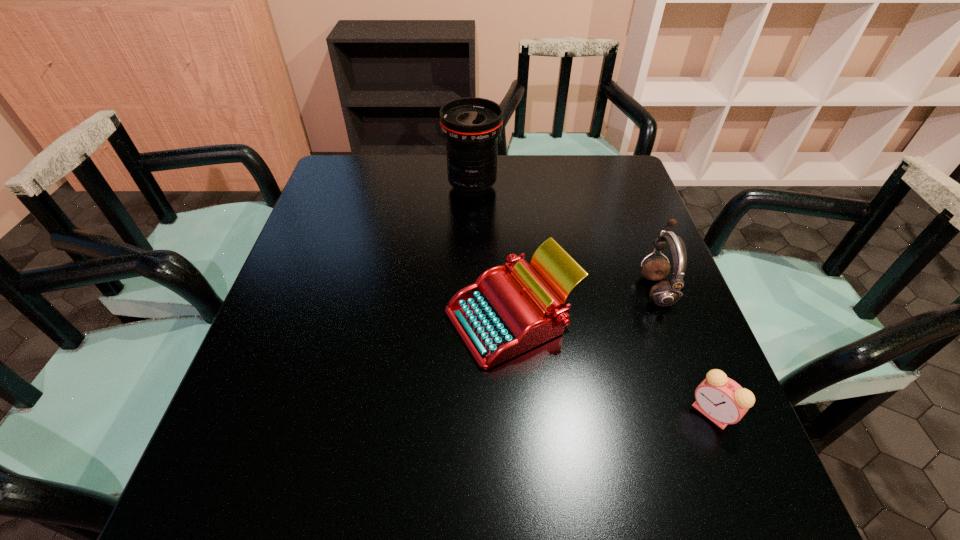
The height and width of the screenshot is (540, 960). I want to click on vacant point located between the telephoto lens and the second tallest object, so click(x=564, y=238).

At what (x,y) coordinates should I click in order to perform the action: click on vacant point located between the alarm clock and the earphone. Please return your answer as a coordinate pair (x, y). Image resolution: width=960 pixels, height=540 pixels. Looking at the image, I should click on (684, 351).

Find the location of a particular element. object that stands as the second closest to the farthest object is located at coordinates (665, 293).

This screenshot has width=960, height=540. I want to click on object that ranks as the third closest to the telephoto lens, so click(x=721, y=399).